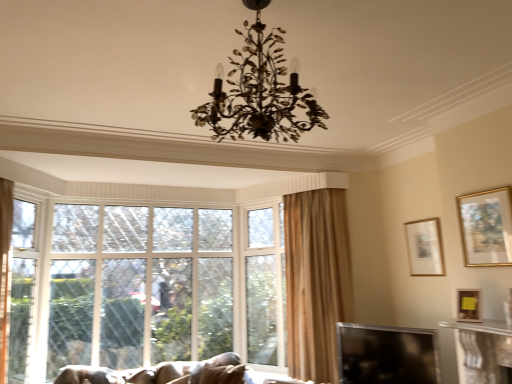
Image resolution: width=512 pixels, height=384 pixels. What do you see at coordinates (259, 91) in the screenshot?
I see `gold metallic chandelier at center` at bounding box center [259, 91].

How much space does matte gold picture frame at upper right, which appears as the third picture frame when viewed from the front, occupy horizontally?

1.73 inches.

You are a GUI agent. You are given a task and a screenshot of the screen. Output one action in this format:
    pyautogui.click(x=<x>, y=<y>)
    Task: Click on the clear glass window at center
    This screenshot has width=512, height=384.
    Given the screenshot: What is the action you would take?
    pyautogui.click(x=145, y=285)

Locate an element on the screen. wooden picture frame at lower right, marked as the 2th picture frame in a back-to-front arrangement is located at coordinates (468, 305).

This screenshot has width=512, height=384. What do you see at coordinates (21, 289) in the screenshot? I see `clear glass screen door at left` at bounding box center [21, 289].

Where is `transparent glass window screen at lower right`? transparent glass window screen at lower right is located at coordinates (387, 355).

Is transparent glass window screen at lower right outside of matte gold picture frame at upper right, which appears as the third picture frame when viewed from the front?

transparent glass window screen at lower right is positioned outside matte gold picture frame at upper right, which appears as the third picture frame when viewed from the front.

Which object is wider, transparent glass window screen at lower right or matte gold picture frame at upper right, which appears as the third picture frame when viewed from the front?

Wider between the two is transparent glass window screen at lower right.

Is transparent glass window screen at lower right placed right next to matte gold picture frame at upper right, placed as the first picture frame when sorted from back to front?

No, transparent glass window screen at lower right is not making contact with matte gold picture frame at upper right, placed as the first picture frame when sorted from back to front.

Find the location of a particular element. This screenshot has width=512, height=384. the 2nd picture frame positioned above the transparent glass window screen at lower right (from the image's perspective) is located at coordinates (424, 247).

Which object is further away from the camera taking this photo, wooden picture frame at lower right, the second picture frame positioned from the front, or gold-framed painting at upper right, which ranks as the first picture frame in front-to-back order?

wooden picture frame at lower right, the second picture frame positioned from the front, is more distant.

Is wooden picture frame at lower right, marked as the 2th picture frame in a back-to-front arrangement, next to gold-framed painting at upper right, the third picture frame from the back, and touching it?

No, wooden picture frame at lower right, marked as the 2th picture frame in a back-to-front arrangement, is not touching gold-framed painting at upper right, the third picture frame from the back.

From a real-world perspective, is wooden picture frame at lower right, marked as the 2th picture frame in a back-to-front arrangement, located higher than gold-framed painting at upper right, the third picture frame from the back?

No, from a real-world perspective, wooden picture frame at lower right, marked as the 2th picture frame in a back-to-front arrangement, is not over gold-framed painting at upper right, the third picture frame from the back

From the image's perspective, is wooden picture frame at lower right, marked as the 2th picture frame in a back-to-front arrangement, located beneath gold-framed painting at upper right, which ranks as the first picture frame in front-to-back order?

Yes, from the image's perspective, wooden picture frame at lower right, marked as the 2th picture frame in a back-to-front arrangement, is beneath gold-framed painting at upper right, which ranks as the first picture frame in front-to-back order.

Is matte gold picture frame at upper right, which appears as the third picture frame when viewed from the front, smaller than gold metallic chandelier at center?

Yes.

Considering the sizes of matte gold picture frame at upper right, which appears as the third picture frame when viewed from the front, and gold metallic chandelier at center in the image, is matte gold picture frame at upper right, which appears as the third picture frame when viewed from the front, taller or shorter than gold metallic chandelier at center?

matte gold picture frame at upper right, which appears as the third picture frame when viewed from the front, is shorter than gold metallic chandelier at center.

Is matte gold picture frame at upper right, which appears as the third picture frame when viewed from the front, closer to camera compared to gold metallic chandelier at center?

No, the depth of matte gold picture frame at upper right, which appears as the third picture frame when viewed from the front, is greater than that of gold metallic chandelier at center.

Can you confirm if wooden picture frame at lower right, marked as the 2th picture frame in a back-to-front arrangement, is taller than velvet brown sofa at lower left?

In fact, wooden picture frame at lower right, marked as the 2th picture frame in a back-to-front arrangement, may be shorter than velvet brown sofa at lower left.

In the image, is wooden picture frame at lower right, the second picture frame positioned from the front, on the left side or the right side of velvet brown sofa at lower left?

Based on their positions, wooden picture frame at lower right, the second picture frame positioned from the front, is located to the right of velvet brown sofa at lower left.

Is point (468, 304) farther from camera compared to point (176, 375)?

That is False.

From the image's perspective, which is below, velvet brown sofa at lower left or matte gold picture frame at upper right, which appears as the third picture frame when viewed from the front?

velvet brown sofa at lower left, from the image's perspective.

Consider the image. Which is more to the right, velvet brown sofa at lower left or matte gold picture frame at upper right, which appears as the third picture frame when viewed from the front?

matte gold picture frame at upper right, which appears as the third picture frame when viewed from the front, is more to the right.

I want to click on picture frame behind the velvet brown sofa at lower left, so click(x=424, y=247).

From a real-world perspective, is velvet brown sofa at lower left on top of matte gold picture frame at upper right, placed as the first picture frame when sorted from back to front?

Actually, velvet brown sofa at lower left is physically below matte gold picture frame at upper right, placed as the first picture frame when sorted from back to front, in the real world.

From a real-world perspective, who is located higher, clear glass screen door at left or transparent glass window screen at lower right?

clear glass screen door at left.

Identify the location of window screen behind the clear glass screen door at left. The width and height of the screenshot is (512, 384). (387, 355).

Considering the relative sizes of clear glass screen door at left and transparent glass window screen at lower right in the image provided, is clear glass screen door at left smaller than transparent glass window screen at lower right?

Actually, clear glass screen door at left might be larger than transparent glass window screen at lower right.

Considering the sizes of clear glass screen door at left and transparent glass window screen at lower right in the image, is clear glass screen door at left taller or shorter than transparent glass window screen at lower right?

Clearly, clear glass screen door at left is taller compared to transparent glass window screen at lower right.

Looking at this image, is gold-framed painting at upper right, the third picture frame from the back, inside the boundaries of clear glass window at center, or outside?

gold-framed painting at upper right, the third picture frame from the back, is not inside clear glass window at center, it's outside.

Considering the points (474, 235) and (74, 338), which point is behind, point (474, 235) or point (74, 338)?

The point (74, 338) is behind.

Can you confirm if gold-framed painting at upper right, which ranks as the first picture frame in front-to-back order, is wider than clear glass window at center?

No, gold-framed painting at upper right, which ranks as the first picture frame in front-to-back order, is not wider than clear glass window at center.

Locate an element on the screen. window screen to the left of matte gold picture frame at upper right, placed as the first picture frame when sorted from back to front is located at coordinates (387, 355).

You are a GUI agent. You are given a task and a screenshot of the screen. Output one action in this format:
    pyautogui.click(x=<x>, y=<y>)
    Task: Click on the picture frame that is the 2nd one above the wooden picture frame at lower right, the second picture frame positioned from the front (from a real-world perspective)
    The height and width of the screenshot is (384, 512).
    Given the screenshot: What is the action you would take?
    pyautogui.click(x=486, y=227)

Looking at the image, which one is located closer to transparent glass window screen at lower right, clear glass screen door at left or matte gold picture frame at upper right, placed as the first picture frame when sorted from back to front?

matte gold picture frame at upper right, placed as the first picture frame when sorted from back to front.

From the image, which object appears to be farther from clear glass window at center, gold-framed painting at upper right, the third picture frame from the back, or wooden picture frame at lower right, the second picture frame positioned from the front?

wooden picture frame at lower right, the second picture frame positioned from the front, is positioned further to the anchor clear glass window at center.

Which object lies further to the anchor point wooden picture frame at lower right, marked as the 2th picture frame in a back-to-front arrangement, transparent glass window screen at lower right or clear glass screen door at left?

Among the two, clear glass screen door at left is located further to wooden picture frame at lower right, marked as the 2th picture frame in a back-to-front arrangement.

Which object lies nearer to the anchor point matte gold picture frame at upper right, placed as the first picture frame when sorted from back to front, transparent glass window screen at lower right or clear glass window at center?

Among the two, transparent glass window screen at lower right is located nearer to matte gold picture frame at upper right, placed as the first picture frame when sorted from back to front.

Estimate the real-world distances between objects in this image. Which object is closer to clear glass window at center, velvet brown sofa at lower left or gold-framed painting at upper right, the third picture frame from the back?

velvet brown sofa at lower left is closer to clear glass window at center.

Which object lies further to the anchor point clear glass window at center, clear glass screen door at left or gold-framed painting at upper right, which ranks as the first picture frame in front-to-back order?

Based on the image, gold-framed painting at upper right, which ranks as the first picture frame in front-to-back order, appears to be further to clear glass window at center.

When comparing their distances from velvet brown sofa at lower left, does wooden picture frame at lower right, marked as the 2th picture frame in a back-to-front arrangement, or gold metallic chandelier at center seem further?

gold metallic chandelier at center is further to velvet brown sofa at lower left.

Which object lies further to the anchor point wooden picture frame at lower right, marked as the 2th picture frame in a back-to-front arrangement, matte gold picture frame at upper right, which appears as the third picture frame when viewed from the front, or velvet brown sofa at lower left?

velvet brown sofa at lower left is further to wooden picture frame at lower right, marked as the 2th picture frame in a back-to-front arrangement.

The height and width of the screenshot is (384, 512). Find the location of `picture frame located between gold-framed painting at upper right, which ranks as the first picture frame in front-to-back order, and matte gold picture frame at upper right, placed as the first picture frame when sorted from back to front, in the depth direction`. picture frame located between gold-framed painting at upper right, which ranks as the first picture frame in front-to-back order, and matte gold picture frame at upper right, placed as the first picture frame when sorted from back to front, in the depth direction is located at coordinates (468, 305).

Identify the location of screen door between velvet brown sofa at lower left and clear glass window at center in the front-back direction. Image resolution: width=512 pixels, height=384 pixels. click(x=21, y=289).

Identify the location of screen door located between gold metallic chandelier at center and clear glass window at center in the depth direction. (21, 289).

Where is `light fixture between clear glass screen door at left and transparent glass window screen at lower right`? The image size is (512, 384). light fixture between clear glass screen door at left and transparent glass window screen at lower right is located at coordinates [259, 91].